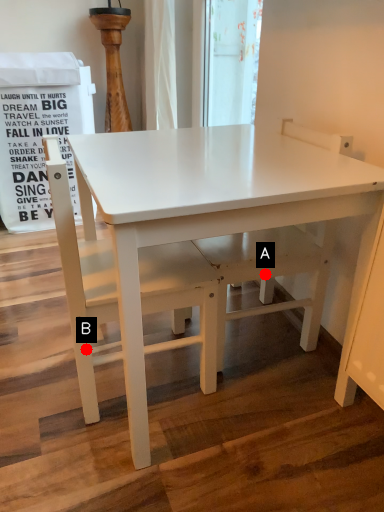
Question: Two points are circled on the image, labeled by A and B beside each circle. Among these points, which one is nearest to the camera?

Choices:
 (A) A is closer
 (B) B is closer

Answer: (B)